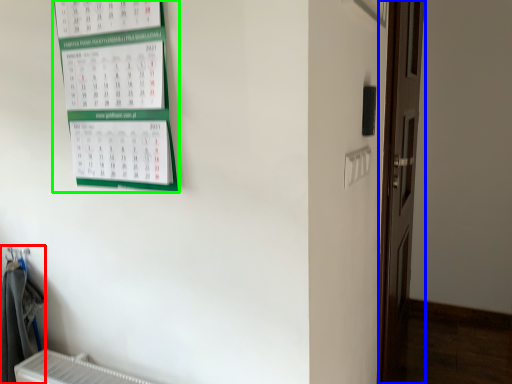
Question: Considering the real-world distances, which object is closest to laundry (highlighted by a red box)? door (highlighted by a blue box) or bulletin board (highlighted by a green box).

Choices:
 (A) door
 (B) bulletin board

Answer: (B)